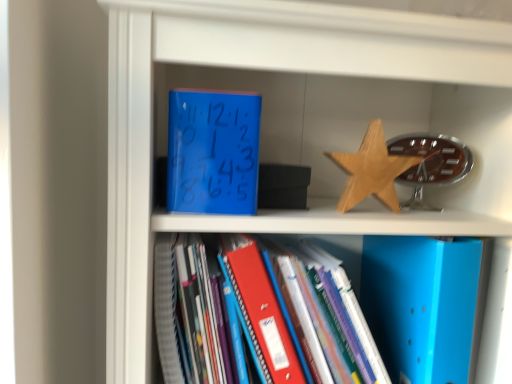
Question: From a real-world perspective, is blue matte clock at upper center, which is the 1th paperback book in left-to-right order, on wooden star at upper right?

Choices:
 (A) yes
 (B) no

Answer: (A)

Question: Is blue matte clock at upper center, the first paperback book from the top, positioned in front of wooden star at upper right?

Choices:
 (A) yes
 (B) no

Answer: (A)

Question: From the image's perspective, is blue matte clock at upper center, which is the 1th paperback book in left-to-right order, under wooden star at upper right?

Choices:
 (A) yes
 (B) no

Answer: (B)

Question: Does blue matte clock at upper center, placed as the second paperback book when sorted from bottom to top, have a greater height compared to wooden star at upper right?

Choices:
 (A) yes
 (B) no

Answer: (A)

Question: Can wooden star at upper right be found inside blue matte clock at upper center, the first paperback book from the top?

Choices:
 (A) yes
 (B) no

Answer: (B)

Question: Does blue matte clock at upper center, the first paperback book from the top, touch wooden star at upper right?

Choices:
 (A) yes
 (B) no

Answer: (B)

Question: From a real-world perspective, is blue matte folder at center physically above blue matte folder at lower right, which ranks as the second paperback book in left-to-right order?

Choices:
 (A) yes
 (B) no

Answer: (B)

Question: Is blue matte folder at center at the right side of blue matte folder at lower right, the first paperback book ordered from the bottom?

Choices:
 (A) no
 (B) yes

Answer: (A)

Question: From a real-world perspective, is blue matte folder at center under blue matte folder at lower right, which is the second paperback book from top to bottom?

Choices:
 (A) yes
 (B) no

Answer: (A)

Question: Can you confirm if blue matte folder at center is taller than blue matte folder at lower right, which ranks as the second paperback book in left-to-right order?

Choices:
 (A) no
 (B) yes

Answer: (B)

Question: Is blue matte folder at center completely or partially outside of blue matte folder at lower right, which ranks as the second paperback book in left-to-right order?

Choices:
 (A) yes
 (B) no

Answer: (A)

Question: Is blue matte folder at center next to blue matte folder at lower right, the first paperback book ordered from the bottom?

Choices:
 (A) yes
 (B) no

Answer: (B)

Question: Is blue matte clock at upper center, the first paperback book from the top, positioned behind blue matte folder at center?

Choices:
 (A) yes
 (B) no

Answer: (A)